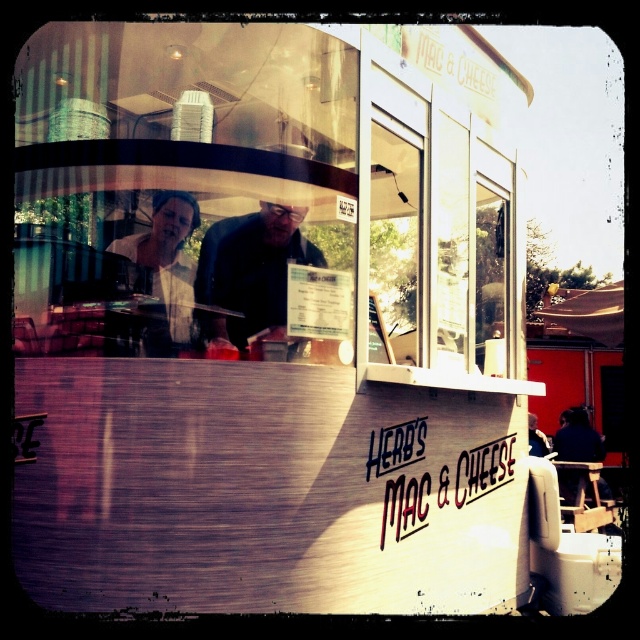
Describe the element at coordinates (248, 275) in the screenshot. I see `dark brown leather jacket at center` at that location.

Does dark brown leather jacket at center come behind matte white shirt at upper left?

Yes.

Locate an element on the screen. This screenshot has width=640, height=640. dark brown leather jacket at center is located at coordinates (248, 275).